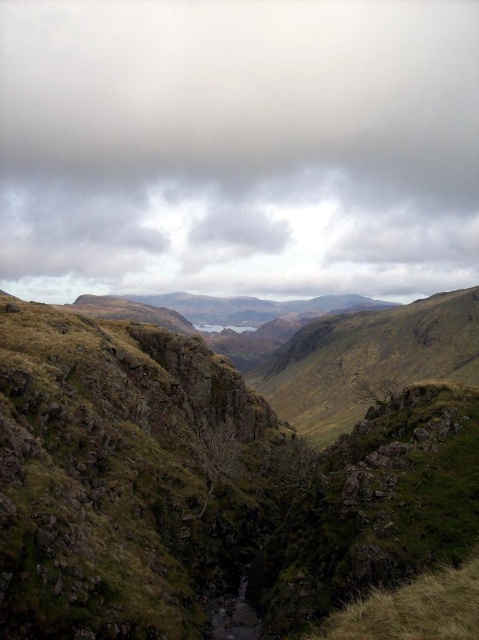
You are a hiker planning to cross the valley. You have a drone that can fly 2000 feet. Can the drone fly from the gray cloudy sky at upper center to the green grassy terrain at center without running out of battery?

The gray cloudy sky at upper center and green grassy terrain at center are 2218.93 feet apart. Since the drone can only fly 2000 feet, it cannot make the trip without running out of battery.

You are a hiker planning to cross the valley using the green grassy terrain at center. Considering the gray cloudy sky at upper center, which object might pose a potential obstacle for your hike and why?

The gray cloudy sky at upper center might pose a potential obstacle because it indicates overcast weather conditions, which could lead to rain or slippery terrain, making the green grassy terrain at center more hazardous to traverse.

You are standing at the point labeled point (401, 429) and want to look towards the valley. Is the point labeled point (187, 168) visible from your current position?

Point (187, 168) is behind point (401, 429), so it is not visible from your current position.